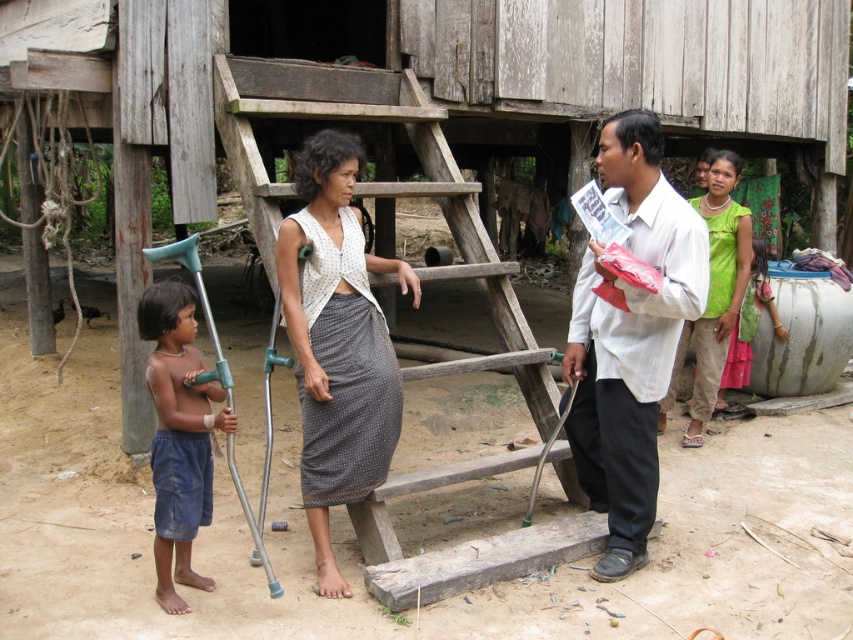
You are a photographer taking a picture of the scene. You notice two points marked in the image. Which point, point (331, 99) or point (720, 164), is closer to your camera lens?

Point (331, 99) is closer to the camera lens than point (720, 164).

You are a delivery person who needs to place a package between the wooden at center and the green fabric top at upper right. The package requires 7 feet of space. Is there enough space between them?

The wooden at center and green fabric top at upper right are 6.92 feet apart. Since the required space is 7 feet, there is not enough space between them to place the package.